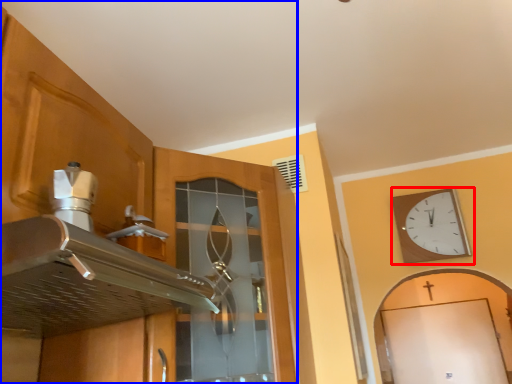
Question: Among these objects, which one is farthest to the camera, wall clock (highlighted by a red box) or cabinetry (highlighted by a blue box)?

Choices:
 (A) wall clock
 (B) cabinetry

Answer: (A)